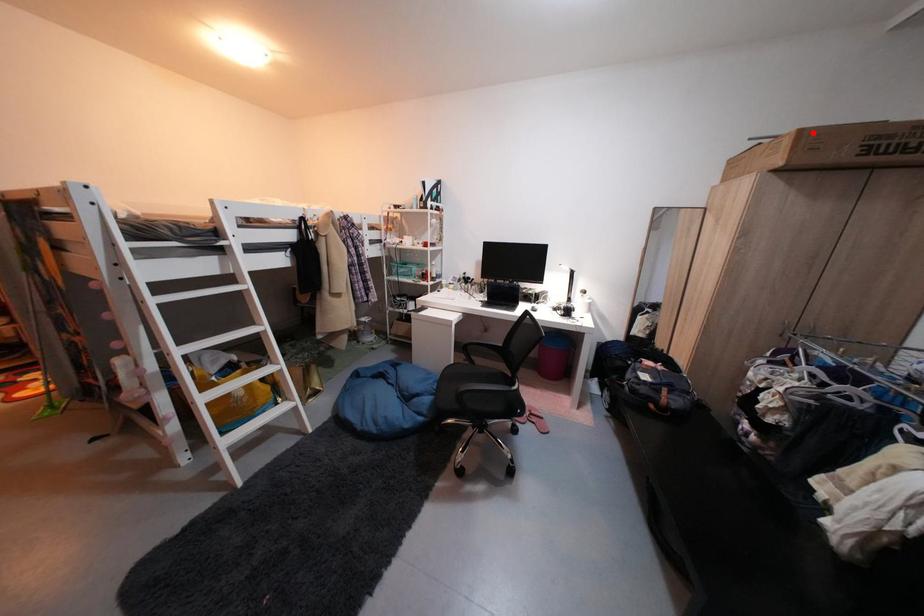
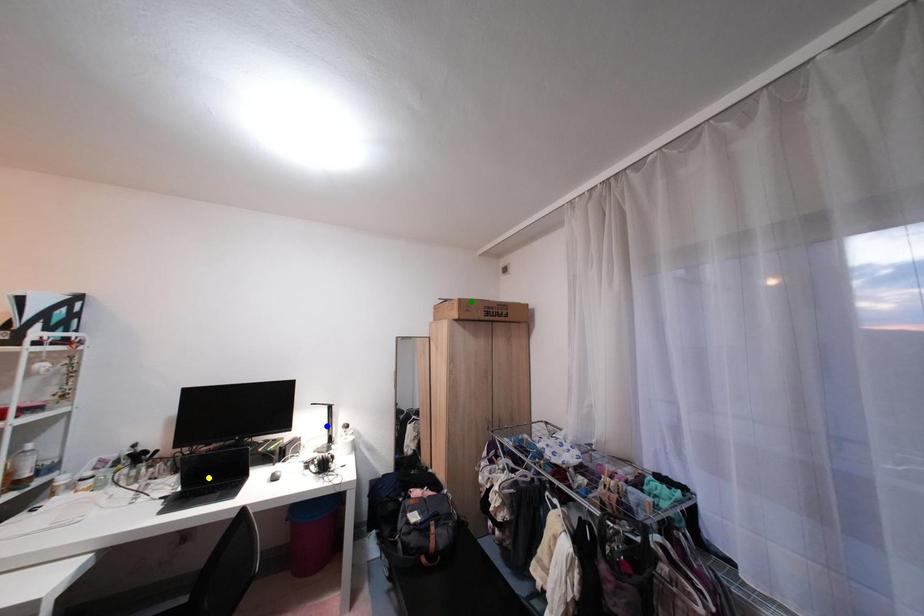
Question: I am providing you with two images of the same scene from different viewpoints. A red point is marked on the first image. You are given multiple points on the second image. Can you choose the point in image 2 that corresponds to the point in image 1?

Choices:
 (A) blue point
 (B) yellow point
 (C) green point

Answer: (C)